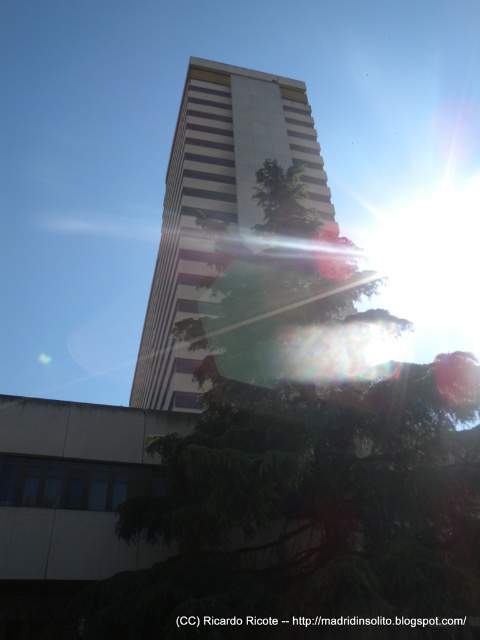
Question: Does green leafy tree at center appear under white striped building at center?

Choices:
 (A) no
 (B) yes

Answer: (B)

Question: Among these points, which one is farthest from the camera?

Choices:
 (A) (140, 502)
 (B) (179, 360)

Answer: (B)

Question: Which point is closer to the camera?

Choices:
 (A) (180, 387)
 (B) (383, 518)

Answer: (B)

Question: Does green leafy tree at center appear under white striped building at center?

Choices:
 (A) yes
 (B) no

Answer: (A)

Question: Can you confirm if green leafy tree at center is positioned to the left of white striped building at center?

Choices:
 (A) no
 (B) yes

Answer: (A)